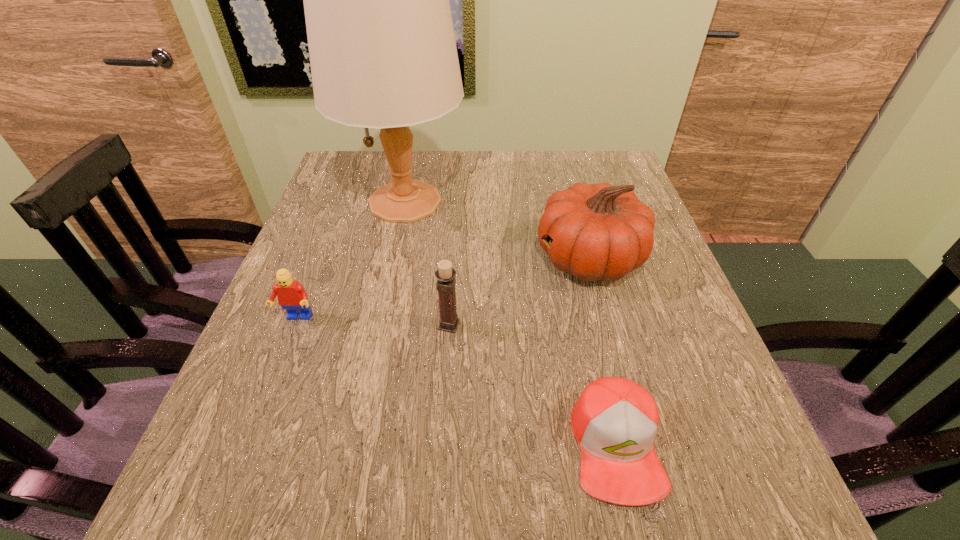
In order to click on vacant area that satisfies the following two spatial constraints: 1. on the front-facing side of the candle holder; 2. on the left side of the second shortest object in this screenshot , I will do `click(294, 325)`.

You are a GUI agent. You are given a task and a screenshot of the screen. Output one action in this format:
    pyautogui.click(x=<x>, y=<y>)
    Task: Click on the free space that satisfies the following two spatial constraints: 1. on the face of the pumpkin; 2. on the front-facing side of the nearest object
    
    Given the screenshot: What is the action you would take?
    pyautogui.click(x=639, y=445)

Where is `free space in the image that satisfies the following two spatial constraints: 1. on the front-facing side of the candle holder; 2. on the left side of the fourth tallest object`? This screenshot has height=540, width=960. free space in the image that satisfies the following two spatial constraints: 1. on the front-facing side of the candle holder; 2. on the left side of the fourth tallest object is located at coordinates (294, 325).